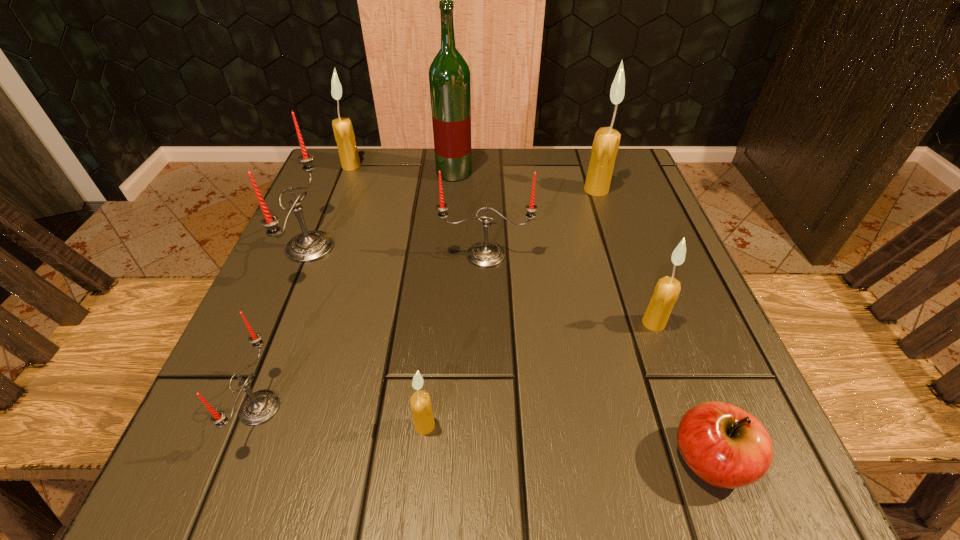
Locate an element on the screen. The image size is (960, 540). free point that satisfies the following two spatial constraints: 1. on the front-facing side of the nearest cream candle; 2. on the left side of the nearest red candle is located at coordinates (253, 425).

I want to click on blank area in the image that satisfies the following two spatial constraints: 1. on the front-facing side of the smallest red candle; 2. on the left side of the apple, so point(240,459).

Locate an element on the screen. free location that satisfies the following two spatial constraints: 1. on the front-facing side of the apple; 2. on the right side of the smallest red candle is located at coordinates (240, 459).

Where is `vacant region that satisfies the following two spatial constraints: 1. on the front side of the shortest object; 2. on the left side of the fifth farthest candle`? The width and height of the screenshot is (960, 540). vacant region that satisfies the following two spatial constraints: 1. on the front side of the shortest object; 2. on the left side of the fifth farthest candle is located at coordinates (702, 459).